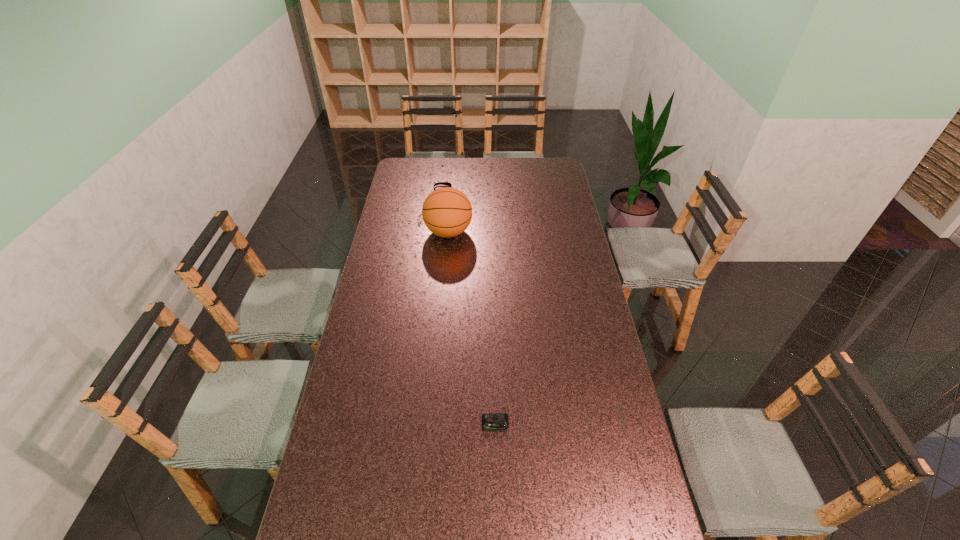
Where is `the second nearest object`? This screenshot has width=960, height=540. the second nearest object is located at coordinates (447, 212).

Image resolution: width=960 pixels, height=540 pixels. I want to click on basketball, so click(x=447, y=212).

Where is `the farthest object`? The height and width of the screenshot is (540, 960). the farthest object is located at coordinates (439, 183).

You are a GUI agent. You are given a task and a screenshot of the screen. Output one action in this format:
    pyautogui.click(x=<x>, y=<y>)
    Task: Click on the alarm clock
    The height and width of the screenshot is (540, 960).
    Given the screenshot: What is the action you would take?
    pyautogui.click(x=490, y=421)

Where is `the nearest object`? the nearest object is located at coordinates (490, 421).

At what (x,y) coordinates should I click in order to perform the action: click on vacant region located 0.250m on the front of the basketball. Please return your answer as a coordinate pair (x, y). Looking at the image, I should click on (444, 288).

This screenshot has height=540, width=960. I want to click on vacant space situated on the display of the farthest object, so click(489, 189).

You are a GUI agent. You are given a task and a screenshot of the screen. Output one action in this format:
    pyautogui.click(x=<x>, y=<y>)
    Task: Click on the vacant space located on the display of the rightmost object
    The image size is (960, 540).
    Given the screenshot: What is the action you would take?
    pyautogui.click(x=498, y=534)

In the image, there is a desktop. In order to click on vacant space at the left edge in this screenshot , I will do `click(372, 332)`.

In the image, there is a desktop. In order to click on vacant space at the right edge in this screenshot , I will do `click(566, 299)`.